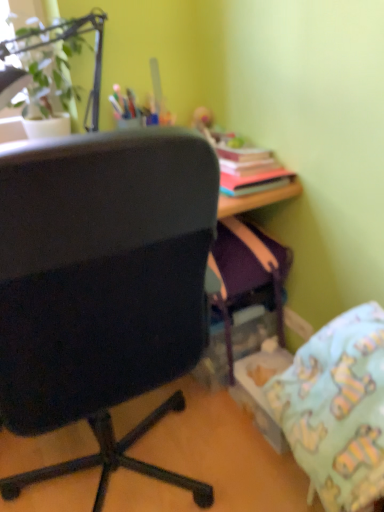
This screenshot has height=512, width=384. What are the coordinates of `light blue fabric pillow at lower right` in the screenshot? It's located at (337, 408).

In the scene shown: Considering the sizes of green leafy plant at upper left and black fabric chair at left in the image, is green leafy plant at upper left wider or thinner than black fabric chair at left?

green leafy plant at upper left is thinner than black fabric chair at left.

Based on the photo, considering the positions of objects green leafy plant at upper left and black fabric chair at left in the image provided, who is more to the right, green leafy plant at upper left or black fabric chair at left?

black fabric chair at left is more to the right.

Is green leafy plant at upper left positioned beyond the bounds of black fabric chair at left?

Absolutely, green leafy plant at upper left is external to black fabric chair at left.

From a real-world perspective, is green leafy plant at upper left positioned above or below black fabric chair at left?

green leafy plant at upper left is situated higher than black fabric chair at left in the real world.

Is light blue fabric pillow at lower right to the left of black fabric chair at left from the viewer's perspective?

Incorrect, light blue fabric pillow at lower right is not on the left side of black fabric chair at left.

From the image's perspective, would you say light blue fabric pillow at lower right is shown under black fabric chair at left?

Correct, light blue fabric pillow at lower right appears lower than black fabric chair at left in the image.

Does point (77, 23) come farther from viewer compared to point (366, 480)?

That is True.

Considering the relative sizes of green leafy plant at upper left and light blue fabric pillow at lower right in the image provided, is green leafy plant at upper left thinner than light blue fabric pillow at lower right?

Yes, green leafy plant at upper left is thinner than light blue fabric pillow at lower right.

Is green leafy plant at upper left positioned far away from light blue fabric pillow at lower right?

Yes, green leafy plant at upper left and light blue fabric pillow at lower right are quite far apart.

Is point (8, 232) behind point (97, 10)?

That is False.

Measure the distance between black fabric chair at left and green leafy plant at upper left.

black fabric chair at left is 34.38 inches away from green leafy plant at upper left.

Who is more distant, black fabric chair at left or green leafy plant at upper left?

green leafy plant at upper left.

From the image's perspective, is black fabric chair at left located above green leafy plant at upper left?

No.

From a real-world perspective, relative to light blue fabric pillow at lower right, is black fabric chair at left vertically above or below?

black fabric chair at left is above light blue fabric pillow at lower right.

Considering the relative sizes of black fabric chair at left and light blue fabric pillow at lower right in the image provided, is black fabric chair at left taller than light blue fabric pillow at lower right?

Yes.

Identify the location of pillow that is below the black fabric chair at left (from the image's perspective). This screenshot has height=512, width=384. (337, 408).

From the image's perspective, which object appears higher, black fabric chair at left or light blue fabric pillow at lower right?

black fabric chair at left.

Is point (372, 443) farther from camera compared to point (40, 44)?

No, it is in front of (40, 44).

Is light blue fabric pillow at lower right wider than green leafy plant at upper left?

Yes.

Is light blue fabric pillow at lower right situated inside green leafy plant at upper left or outside?

light blue fabric pillow at lower right lies outside green leafy plant at upper left.

I want to click on chair on the right of the green leafy plant at upper left, so (x=102, y=287).

Locate an element on the screen. The height and width of the screenshot is (512, 384). chair above the light blue fabric pillow at lower right (from a real-world perspective) is located at coordinates (102, 287).

Based on their spatial positions, is black fabric chair at left or light blue fabric pillow at lower right further from green leafy plant at upper left?

The object further to green leafy plant at upper left is light blue fabric pillow at lower right.

Considering their positions, is black fabric chair at left positioned further to light blue fabric pillow at lower right than green leafy plant at upper left?

green leafy plant at upper left is further to light blue fabric pillow at lower right.

Estimate the real-world distances between objects in this image. Which object is closer to green leafy plant at upper left, light blue fabric pillow at lower right or black fabric chair at left?

black fabric chair at left.

Which object lies nearer to the anchor point light blue fabric pillow at lower right, green leafy plant at upper left or black fabric chair at left?

black fabric chair at left.

Based on the photo, from the image, which object appears to be nearer to black fabric chair at left, green leafy plant at upper left or light blue fabric pillow at lower right?

light blue fabric pillow at lower right lies closer to black fabric chair at left than the other object.

Estimate the real-world distances between objects in this image. Which object is further from black fabric chair at left, light blue fabric pillow at lower right or green leafy plant at upper left?

Based on the image, green leafy plant at upper left appears to be further to black fabric chair at left.

Image resolution: width=384 pixels, height=512 pixels. What are the coordinates of `chair between green leafy plant at upper left and light blue fabric pillow at lower right in the horizontal direction` in the screenshot? It's located at (102, 287).